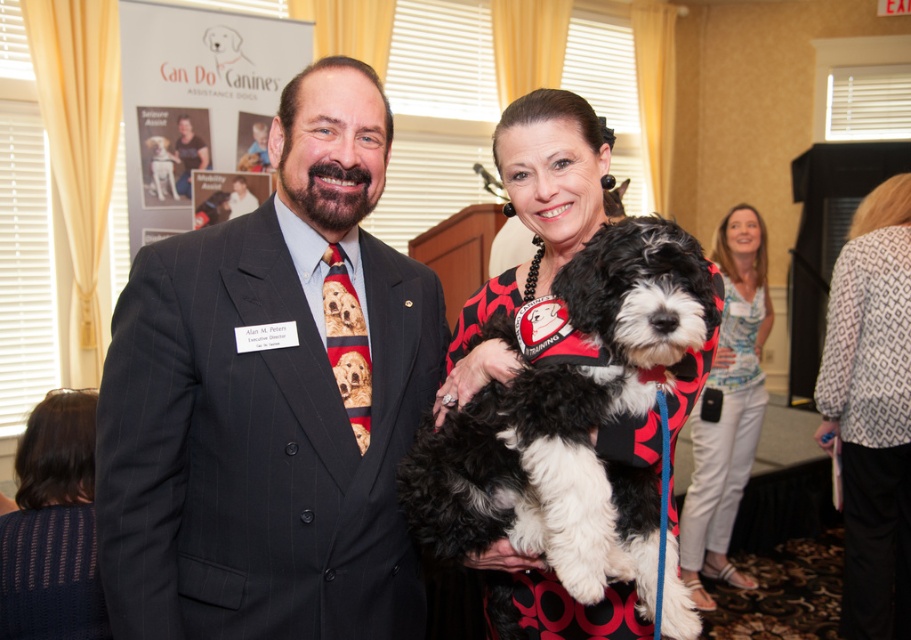
Question: Among these objects, which one is farthest from the camera?

Choices:
 (A) matte black suit at center
 (B) white printed blouse at upper right
 (C) light blue printed blouse at center

Answer: (C)

Question: Does white printed blouse at upper right have a larger size compared to light blue printed blouse at center?

Choices:
 (A) yes
 (B) no

Answer: (B)

Question: Which of the following is the closest to the observer?

Choices:
 (A) matte black suit at center
 (B) light blue printed blouse at center
 (C) fluffy black-and-white dog at center

Answer: (C)

Question: Can you confirm if fluffy black-and-white dog at center is smaller than white printed blouse at upper right?

Choices:
 (A) no
 (B) yes

Answer: (B)

Question: Can you confirm if white printed blouse at upper right is smaller than light blue printed blouse at center?

Choices:
 (A) no
 (B) yes

Answer: (B)

Question: Estimate the real-world distances between objects in this image. Which object is farther from the fluffy black-and-white dog at center?

Choices:
 (A) matte black suit at center
 (B) light blue printed blouse at center
 (C) white printed blouse at upper right

Answer: (B)